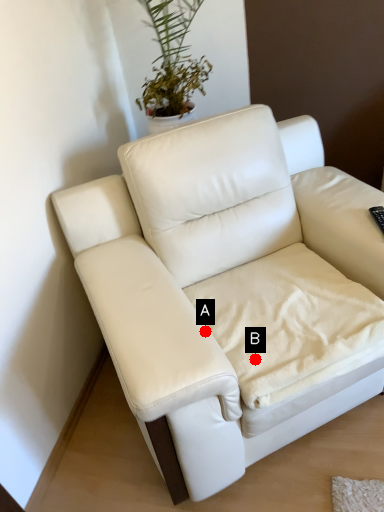
Question: Two points are circled on the image, labeled by A and B beside each circle. Which of the following is the closest to the observer?

Choices:
 (A) A is closer
 (B) B is closer

Answer: (A)